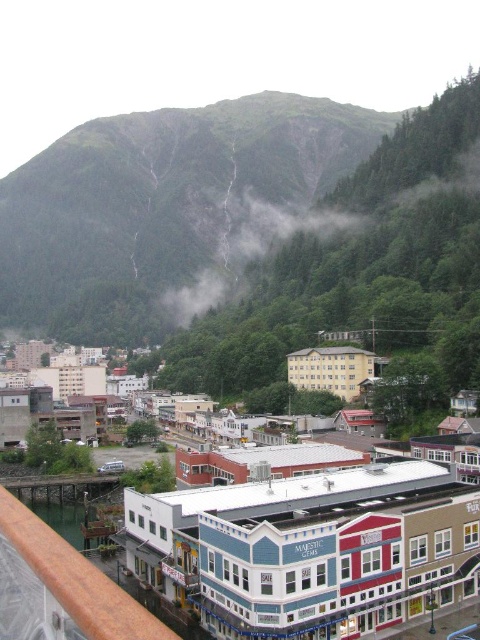
Measure the distance from multicolored painted building at center to foggy misty cloud at center.

They are 238.48 meters apart.

Which is behind, point (223, 616) or point (193, 300)?

The point (193, 300) is more distant.

Between point (351, 513) and point (274, 257), which one is positioned behind?

Positioned behind is point (274, 257).

The height and width of the screenshot is (640, 480). In order to click on multicolored painted building at center in this screenshot , I will do `click(315, 548)`.